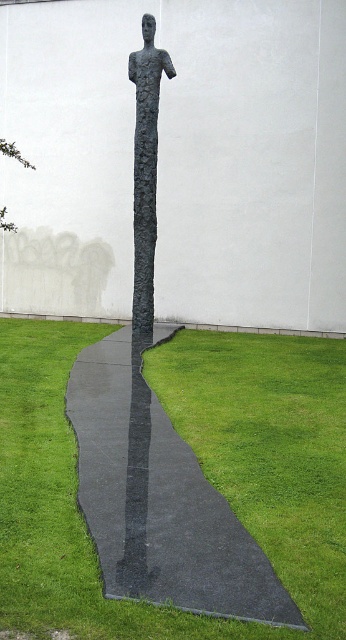
Question: In this image, where is black asphalt at center located relative to dark textured statue at center?

Choices:
 (A) right
 (B) left

Answer: (B)

Question: Among these objects, which one is farthest from the camera?

Choices:
 (A) black asphalt at center
 (B) dark textured statue at center

Answer: (A)

Question: Is black asphalt at center thinner than dark textured statue at center?

Choices:
 (A) no
 (B) yes

Answer: (B)

Question: Among these objects, which one is farthest from the camera?

Choices:
 (A) dark textured statue at center
 (B) black asphalt at center

Answer: (B)

Question: Which point is closer to the camera taking this photo?

Choices:
 (A) (142, 464)
 (B) (246, 582)

Answer: (B)

Question: Is black asphalt at center to the left of dark textured statue at center from the viewer's perspective?

Choices:
 (A) no
 (B) yes

Answer: (B)